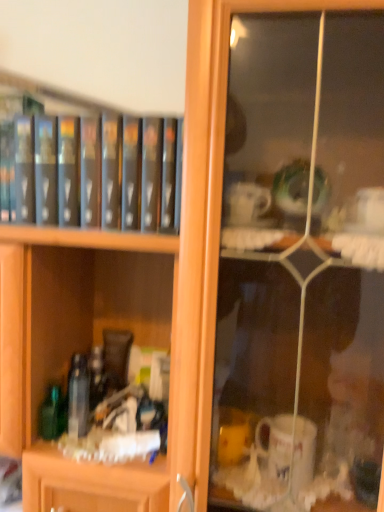
Question: Looking at their shapes, would you say green glass bottle at lower left, which appears as the second bottle when viewed from the right, is wider or thinner than clear glass bottle at center, arranged as the second bottle when viewed from the left?

Choices:
 (A) thin
 (B) wide

Answer: (B)

Question: In the image, is green glass bottle at lower left, which appears as the second bottle when viewed from the right, on the left side or the right side of clear glass bottle at center, the first bottle from the right?

Choices:
 (A) right
 (B) left

Answer: (B)

Question: Estimate the real-world distances between objects in this image. Which object is farther from the black matte book at upper left?

Choices:
 (A) green glass bottle at lower left, which is the 1th bottle in left-to-right order
 (B) clear glass bottle at center, the first bottle from the right

Answer: (A)

Question: Considering the real-world distances, which object is farthest from the clear glass bottle at center, arranged as the second bottle when viewed from the left?

Choices:
 (A) black matte book at upper left
 (B) green glass bottle at lower left, which is the 1th bottle in left-to-right order

Answer: (A)